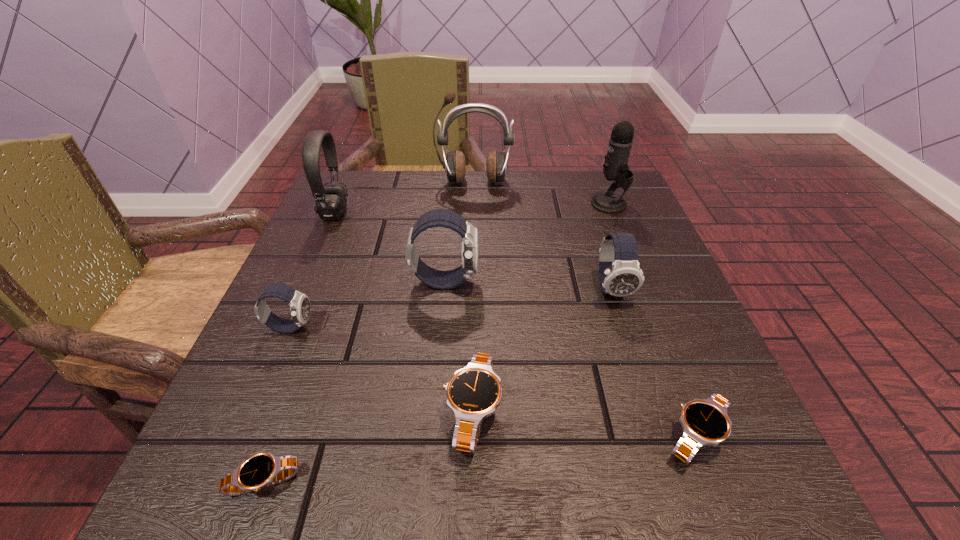
Where is `object located at the far left corner`? object located at the far left corner is located at coordinates (330, 200).

Image resolution: width=960 pixels, height=540 pixels. Identify the location of object that is at the near left corner. (263, 469).

Image resolution: width=960 pixels, height=540 pixels. In order to click on object located in the far right corner section of the desktop in this screenshot , I will do `click(615, 168)`.

The height and width of the screenshot is (540, 960). I want to click on object that is at the near right corner, so click(705, 421).

You are a GUI agent. You are given a task and a screenshot of the screen. Output one action in this format:
    pyautogui.click(x=<x>, y=<y>)
    Task: Click on the free spot at the far edge of the desktop
    Image resolution: width=960 pixels, height=540 pixels.
    Given the screenshot: What is the action you would take?
    pyautogui.click(x=418, y=196)

Find the location of a particular element. This screenshot has height=540, width=960. free location at the near edge of the desktop is located at coordinates (427, 466).

Where is `blank space at the left edge of the desktop`? This screenshot has height=540, width=960. blank space at the left edge of the desktop is located at coordinates (x=324, y=403).

The width and height of the screenshot is (960, 540). Identify the location of free space at the right edge of the desktop. (587, 251).

The image size is (960, 540). What are the coordinates of `vacant space at the far right corner of the desktop` in the screenshot? It's located at (590, 178).

I want to click on vacant area between the headset and the sixth shortest object, so click(390, 247).